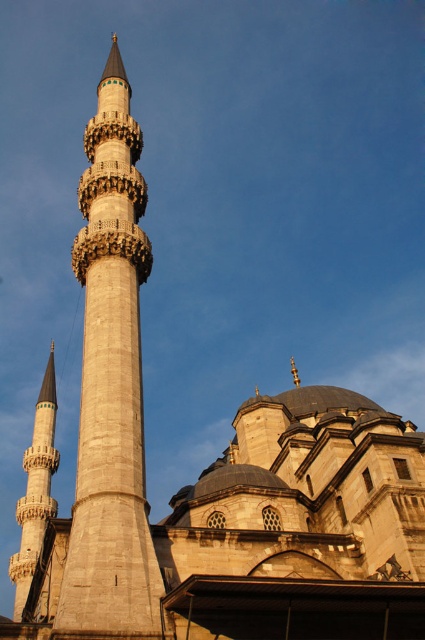
Question: Does light beige stone minaret at center lie in front of smooth stone minaret at left?

Choices:
 (A) yes
 (B) no

Answer: (A)

Question: Which point is farther to the camera?

Choices:
 (A) smooth stone minaret at left
 (B) light beige stone minaret at center

Answer: (A)

Question: Which point is farther from the camera taking this photo?

Choices:
 (A) (28, 572)
 (B) (119, 204)

Answer: (A)

Question: Can you confirm if light beige stone minaret at center is wider than smooth stone minaret at left?

Choices:
 (A) yes
 (B) no

Answer: (B)

Question: Can you confirm if light beige stone minaret at center is smaller than smooth stone minaret at left?

Choices:
 (A) yes
 (B) no

Answer: (A)